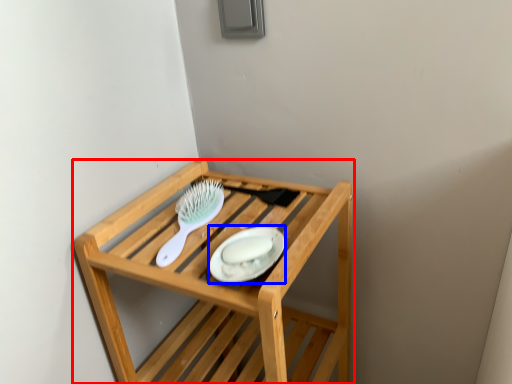
Question: Which object is closer to the camera taking this photo, furniture (highlighted by a red box) or platter (highlighted by a blue box)?

Choices:
 (A) furniture
 (B) platter

Answer: (A)